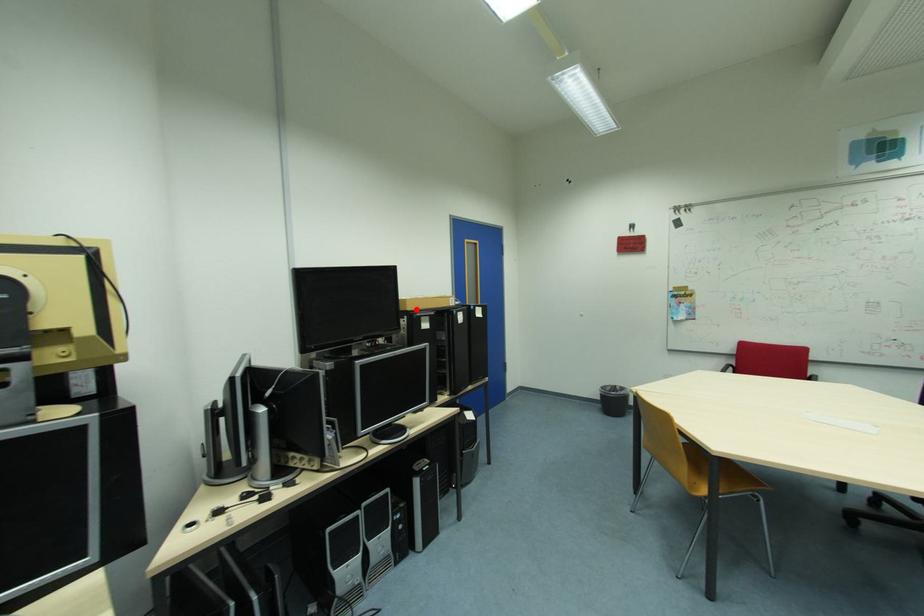
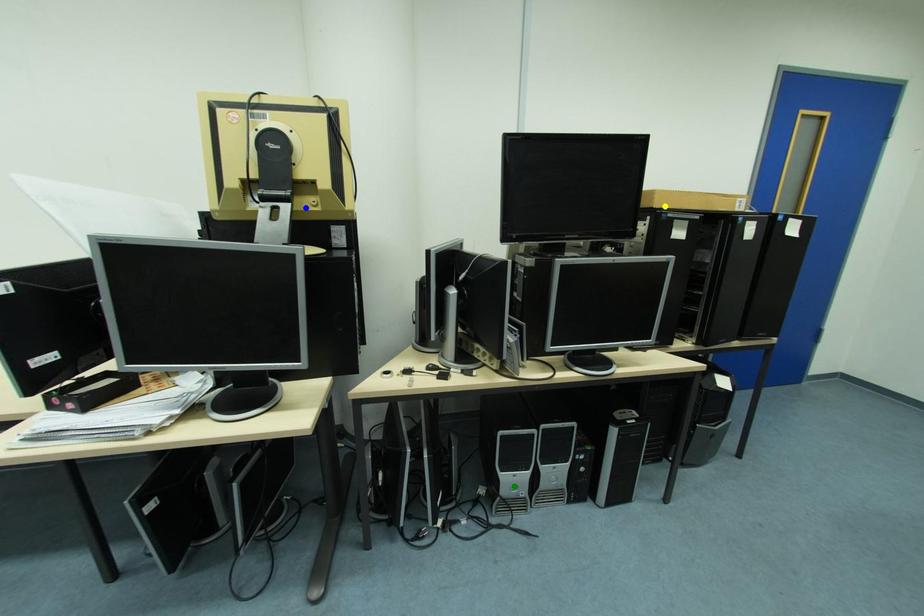
Question: I am providing you with two images of the same scene from different viewpoints. A red point is marked on the first image. You are given multiple points on the second image. Which point in image 2 is actually the same real-world point as the red point in image 1?

Choices:
 (A) blue point
 (B) green point
 (C) yellow point

Answer: (C)